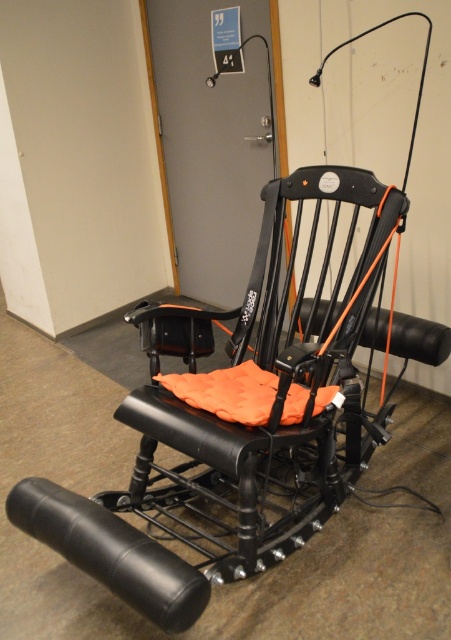
Question: Can you confirm if black matte/leather chair at center is wider than black leather armrest at lower left?

Choices:
 (A) yes
 (B) no

Answer: (A)

Question: Is black matte/leather chair at center smaller than black leather armrest at lower left?

Choices:
 (A) yes
 (B) no

Answer: (B)

Question: Does black matte/leather chair at center have a larger size compared to black leather armrest at lower left?

Choices:
 (A) no
 (B) yes

Answer: (B)

Question: Among these objects, which one is nearest to the camera?

Choices:
 (A) black leather armrest at lower left
 (B) black matte/leather chair at center

Answer: (A)

Question: Among these objects, which one is nearest to the camera?

Choices:
 (A) black matte/leather chair at center
 (B) black leather armrest at lower left

Answer: (B)

Question: Which of the following is the closest to the observer?

Choices:
 (A) black leather armrest at lower left
 (B) black matte/leather chair at center

Answer: (A)